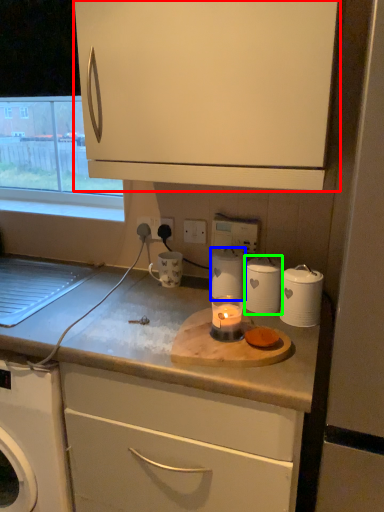
Question: Based on their relative distances, which object is nearer to cabinetry (highlighted by a red box)? Choose from kitchen appliance (highlighted by a blue box) and kitchen appliance (highlighted by a green box).

Choices:
 (A) kitchen appliance
 (B) kitchen appliance

Answer: (B)